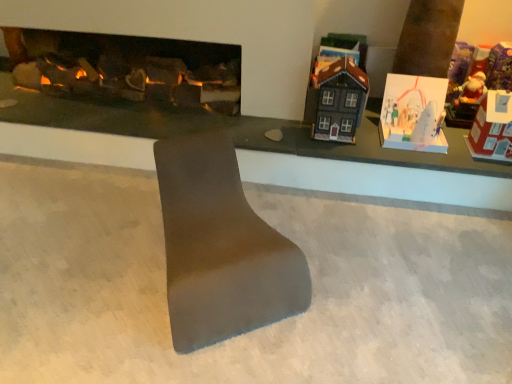
Question: Does matte black house at upper right, the third toy positioned from the right, have a lesser height compared to dark gray matte house at upper right, arranged as the fourth toy when viewed from the right?

Choices:
 (A) no
 (B) yes

Answer: (B)

Question: Is matte black house at upper right, placed as the 2th toy when sorted from left to right, surrounding dark gray matte house at upper right, the first toy in the left-to-right sequence?

Choices:
 (A) no
 (B) yes

Answer: (A)

Question: Considering the relative positions of matte black house at upper right, the third toy positioned from the right, and dark gray matte house at upper right, the first toy in the left-to-right sequence, in the image provided, is matte black house at upper right, the third toy positioned from the right, to the left of dark gray matte house at upper right, the first toy in the left-to-right sequence, from the viewer's perspective?

Choices:
 (A) no
 (B) yes

Answer: (A)

Question: Does matte black house at upper right, placed as the 2th toy when sorted from left to right, have a lesser width compared to dark gray matte house at upper right, the first toy in the left-to-right sequence?

Choices:
 (A) no
 (B) yes

Answer: (B)

Question: Can you confirm if matte black house at upper right, the third toy positioned from the right, is wider than dark gray matte house at upper right, arranged as the fourth toy when viewed from the right?

Choices:
 (A) yes
 (B) no

Answer: (B)

Question: Is matte black house at upper right, placed as the 2th toy when sorted from left to right, taller or shorter than smooth gray concrete at center?

Choices:
 (A) tall
 (B) short

Answer: (A)

Question: In the image, is matte black house at upper right, placed as the 2th toy when sorted from left to right, positioned in front of or behind smooth gray concrete at center?

Choices:
 (A) front
 (B) behind

Answer: (B)

Question: Is matte black house at upper right, the third toy positioned from the right, spatially inside smooth gray concrete at center, or outside of it?

Choices:
 (A) inside
 (B) outside

Answer: (B)

Question: Looking at their shapes, would you say matte black house at upper right, placed as the 2th toy when sorted from left to right, is wider or thinner than smooth gray concrete at center?

Choices:
 (A) wide
 (B) thin

Answer: (B)

Question: From a real-world perspective, is white paper card at upper right, acting as the second toy starting from the right, above or below red cardboard house at right, which is counted as the first toy, starting from the right?

Choices:
 (A) above
 (B) below

Answer: (B)

Question: In terms of height, does white paper card at upper right, acting as the second toy starting from the right, look taller or shorter compared to red cardboard house at right, placed as the 4th toy when sorted from left to right?

Choices:
 (A) short
 (B) tall

Answer: (A)

Question: Is white paper card at upper right, the 3th toy in the left-to-right sequence, spatially inside red cardboard house at right, placed as the 4th toy when sorted from left to right, or outside of it?

Choices:
 (A) inside
 (B) outside

Answer: (B)

Question: Considering their positions, is white paper card at upper right, the 3th toy in the left-to-right sequence, located in front of or behind red cardboard house at right, placed as the 4th toy when sorted from left to right?

Choices:
 (A) behind
 (B) front

Answer: (A)

Question: Is matte black house at upper right, the third toy positioned from the right, bigger or smaller than red cardboard house at right, placed as the 4th toy when sorted from left to right?

Choices:
 (A) small
 (B) big

Answer: (A)

Question: Considering the positions of matte black house at upper right, the third toy positioned from the right, and red cardboard house at right, placed as the 4th toy when sorted from left to right, in the image, is matte black house at upper right, the third toy positioned from the right, taller or shorter than red cardboard house at right, placed as the 4th toy when sorted from left to right,?

Choices:
 (A) tall
 (B) short

Answer: (B)